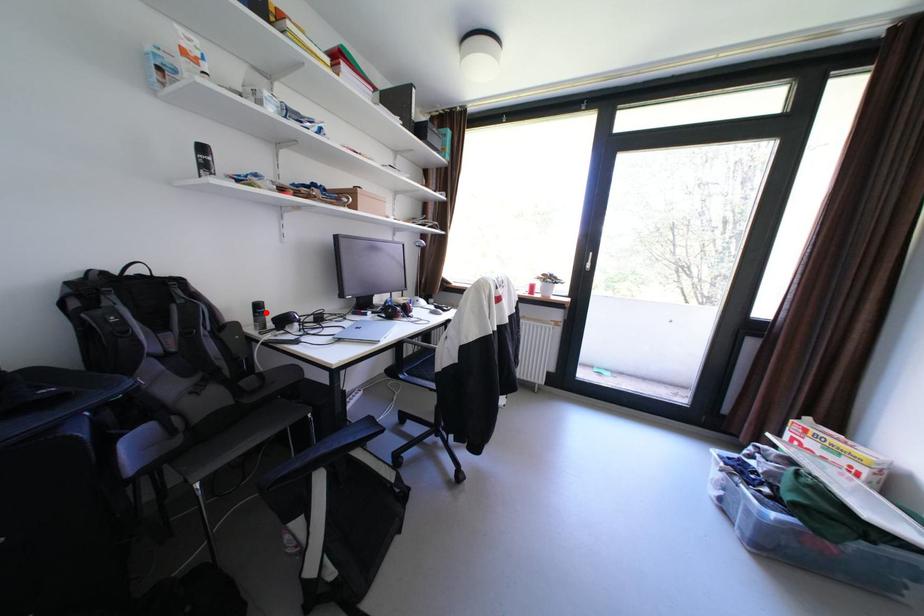
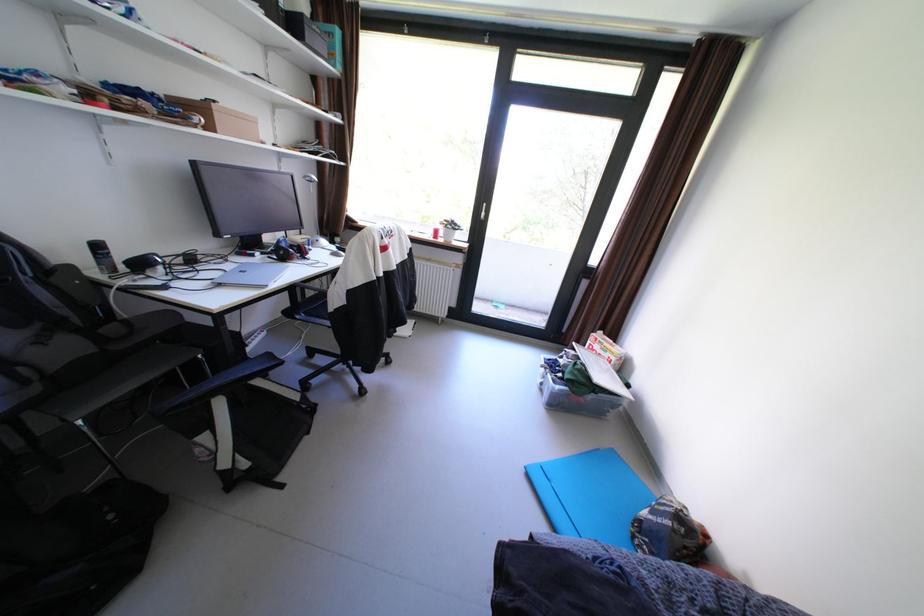
Question: I am providing you with two images of the same scene from different viewpoints. A red point is shown in image1. For the corresponding object point in image2, is it positioned nearer or farther from the camera?

Choices:
 (A) Nearer
 (B) Farther

Answer: (B)